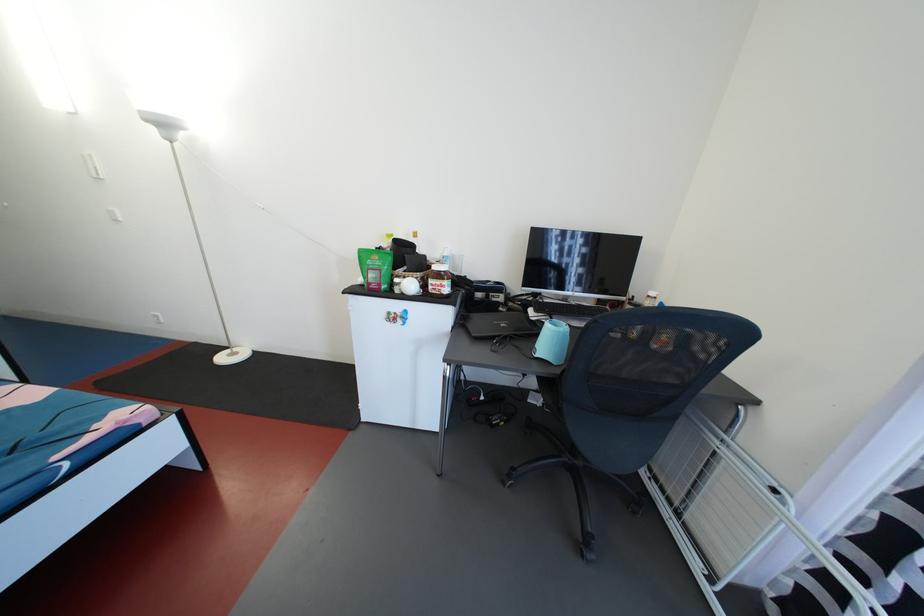
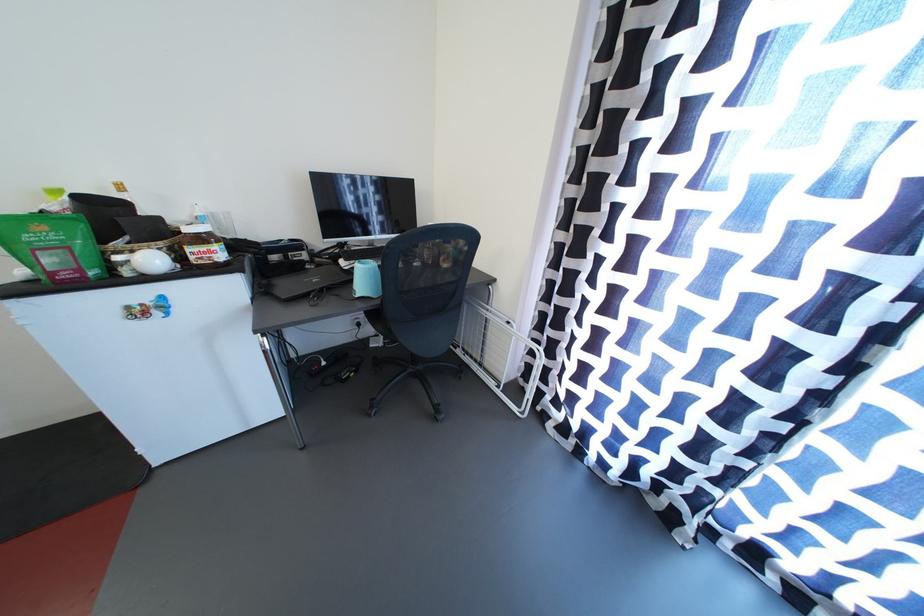
Find the pixel in the second image that matches pixel 393 248 in the first image.

(64, 209)